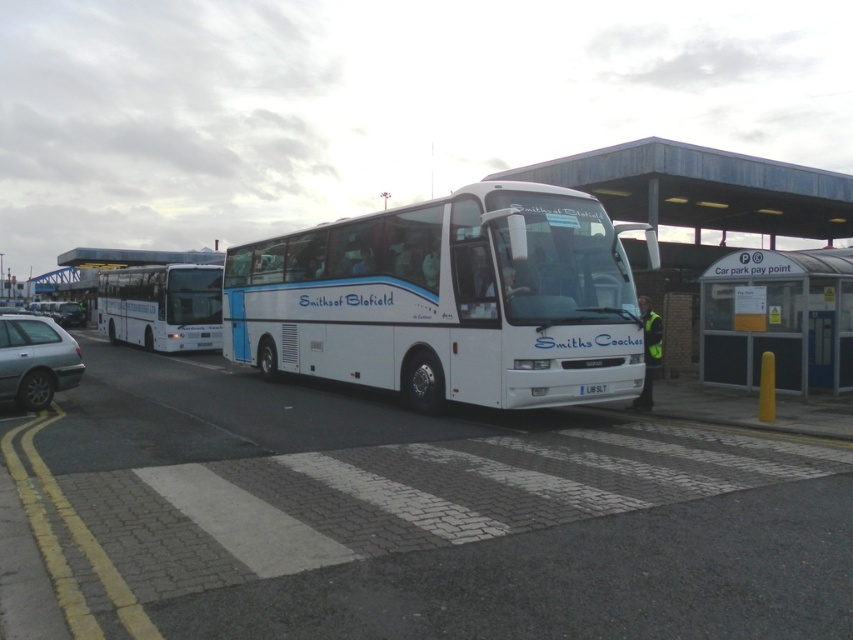
You are standing at the bus station and want to take a photo of the white glossy bus at center. If your camera can focus on objects up to 25 meters away, will you be able to take a clear photo?

The white glossy bus at center is 24.87 meters away from the camera, which is within the camera focus range of up to 25 meters. Therefore, you can take a clear photo.

You are a pedestrian standing at the pedestrian crossing near the white glossy coach at center and the white plastic bus at center. Which of these two vehicles is closer to you?

The white glossy coach at center is closer to you as it is positioned in front of the white plastic bus at center.